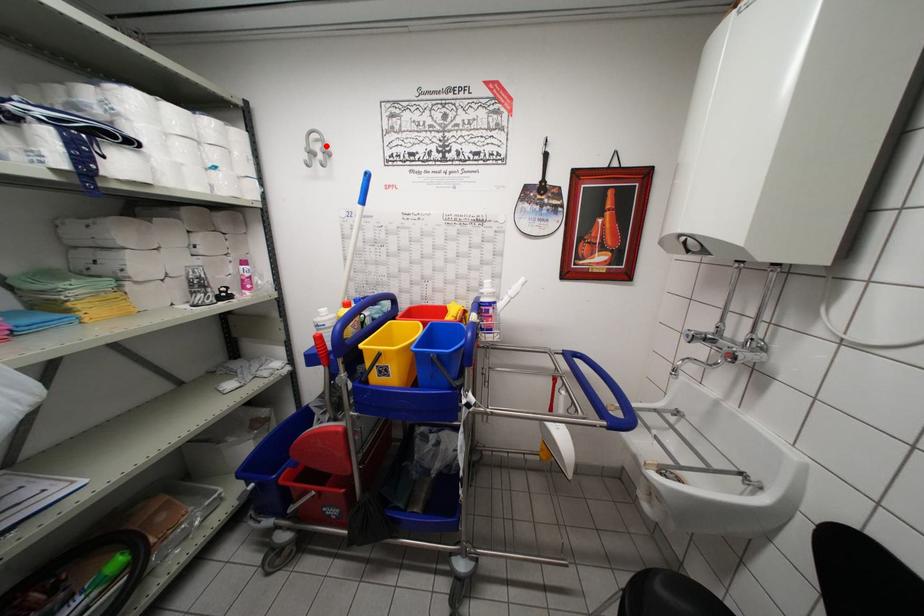
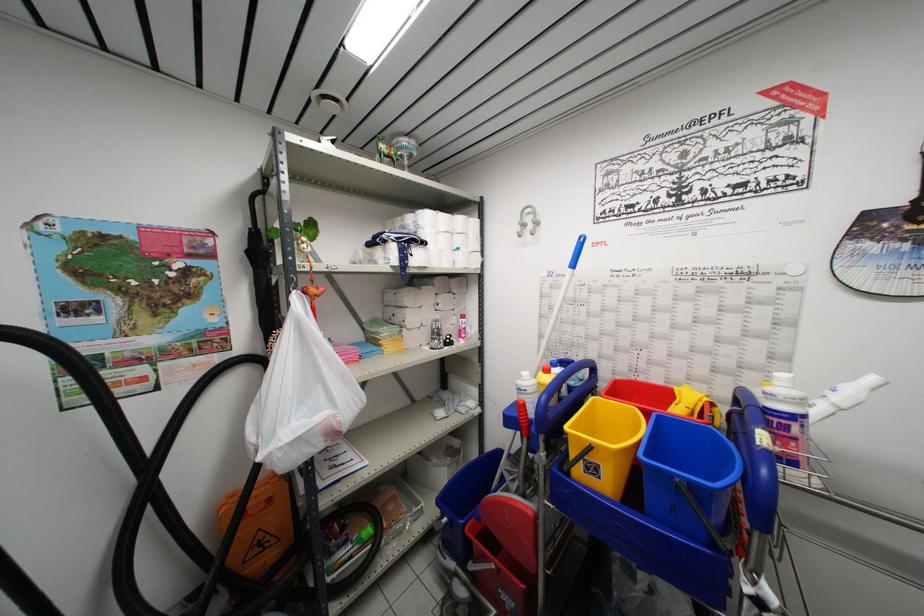
Find the pixel in the second image that matches the highlighted location in the first image.

(537, 217)